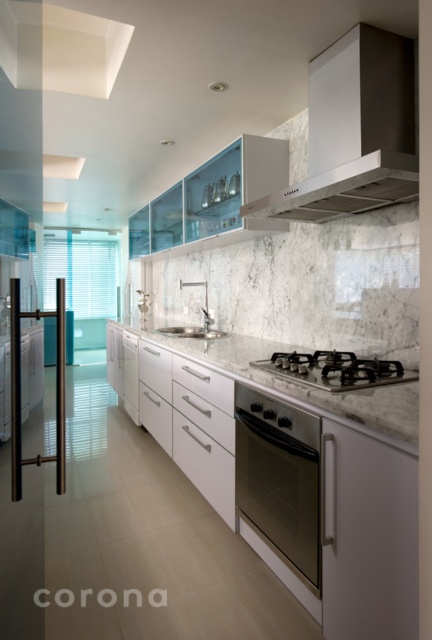
Does satin silver stove at center lie in front of white marble sink at center?

Yes.

Is point (339, 358) less distant than point (206, 284)?

Yes.

What do you see at coordinates (334, 369) in the screenshot?
I see `satin silver stove at center` at bounding box center [334, 369].

The image size is (432, 640). I want to click on satin silver stove at center, so click(334, 369).

Which is in front, point (10, 429) or point (368, 381)?

Point (10, 429)

Is polished brass handle at center smaller than satin silver stove at center?

No, polished brass handle at center is not smaller than satin silver stove at center.

Does point (12, 490) come behind point (396, 365)?

No, (12, 490) is in front of (396, 365).

The image size is (432, 640). What are the coordinates of `polished brass handle at center` in the screenshot? It's located at (19, 388).

Is point (238, 378) farther from camera compared to point (219, 333)?

No, it is not.

Which is in front, point (231, 376) or point (206, 328)?

Positioned in front is point (231, 376).

Image resolution: width=432 pixels, height=640 pixels. Identify the location of white marble countertop at center. (304, 385).